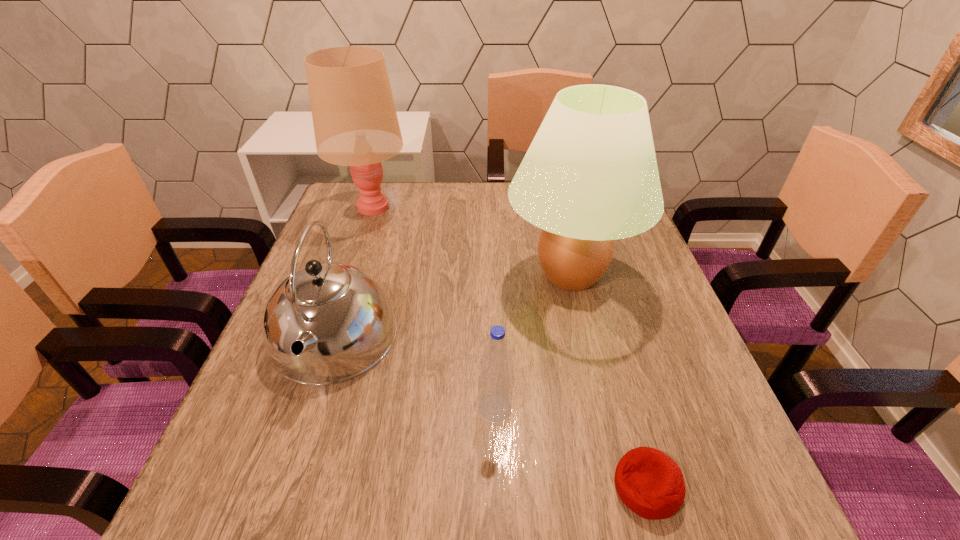
Where is `kettle located at the left edge`? The height and width of the screenshot is (540, 960). kettle located at the left edge is located at coordinates (327, 323).

You are a GUI agent. You are given a task and a screenshot of the screen. Output one action in this format:
    pyautogui.click(x=<x>, y=<y>)
    Task: Click on the lampshade at the right edge
    This screenshot has width=960, height=540.
    Given the screenshot: What is the action you would take?
    pyautogui.click(x=590, y=176)

Locate an element on the screen. beanbag present at the right edge is located at coordinates (650, 483).

Locate an element on the screen. object that is at the far left corner is located at coordinates (355, 122).

This screenshot has width=960, height=540. Identify the location of object situated at the near right corner. (650, 483).

Where is `free space at the far edge`? The width and height of the screenshot is (960, 540). free space at the far edge is located at coordinates (445, 218).

In the image, there is a desktop. Where is `vacant space at the left edge`? The width and height of the screenshot is (960, 540). vacant space at the left edge is located at coordinates (373, 248).

Where is `vacant area at the right edge`? This screenshot has height=540, width=960. vacant area at the right edge is located at coordinates (642, 421).

In the image, there is a desktop. At what (x,y) coordinates should I click in order to perform the action: click on blank space at the near left corner. Please return your answer as a coordinate pair (x, y). Looking at the image, I should click on coord(189,510).

Where is `free space at the near right corner of the desktop`? free space at the near right corner of the desktop is located at coordinates (707, 529).